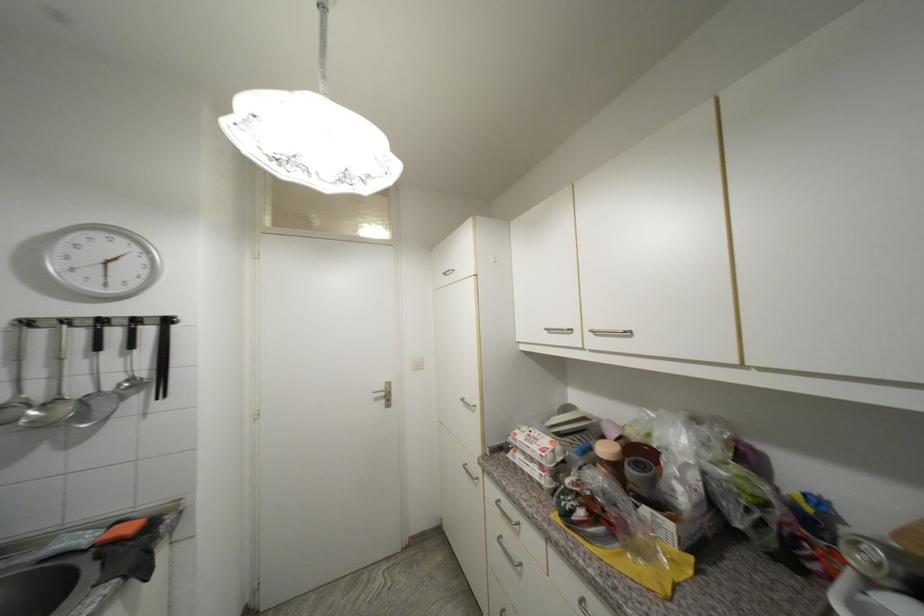
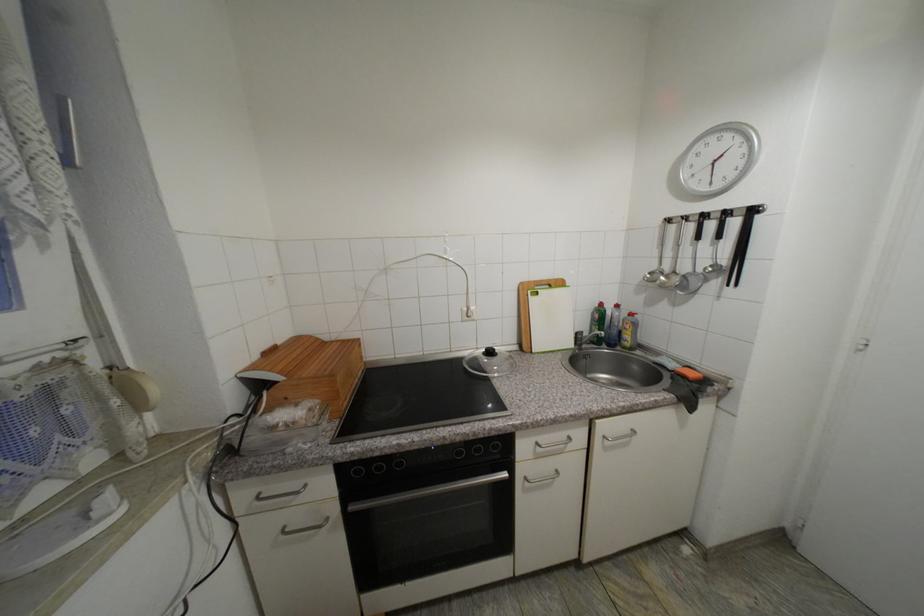
Question: How did the camera likely rotate?

Choices:
 (A) Left
 (B) Right
 (C) Up
 (D) Down

Answer: (A)